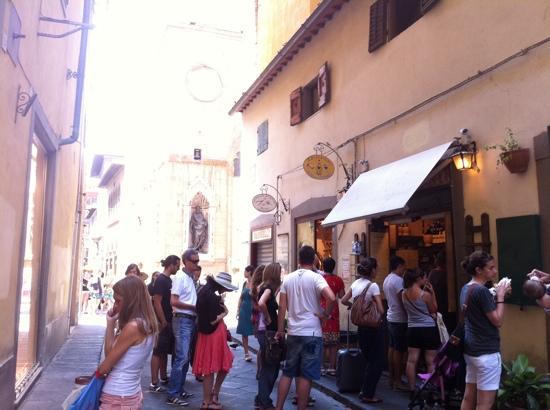
The image size is (550, 410). I want to click on dark red shutter, so click(324, 87), click(298, 105).